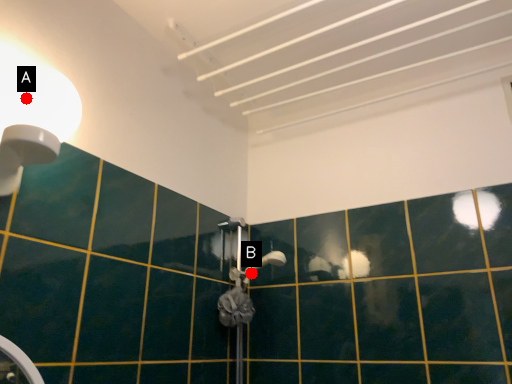
Question: Two points are circled on the image, labeled by A and B beside each circle. Which point appears farthest from the camera in this image?

Choices:
 (A) A is further
 (B) B is further

Answer: (B)